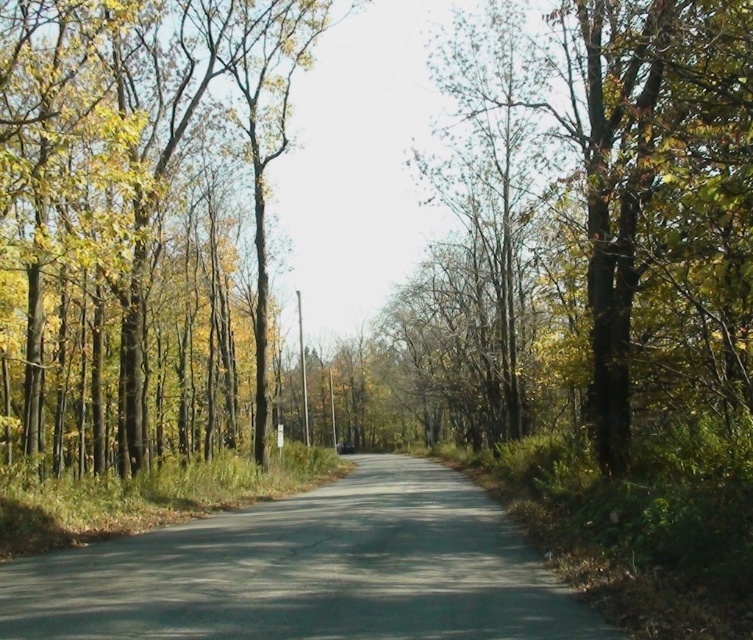
You are a hiker standing on the gray asphalt road at center and want to take a photo of the green matte tree at right. Since the tree is taller than the road, where should you position yourself to ensure the entire tree fits in the frame?

The green matte tree at right is taller than the gray asphalt road at center. To capture the entire tree in your photo, you should position yourself further back from the tree so that the camera can include its full height without cropping the top.